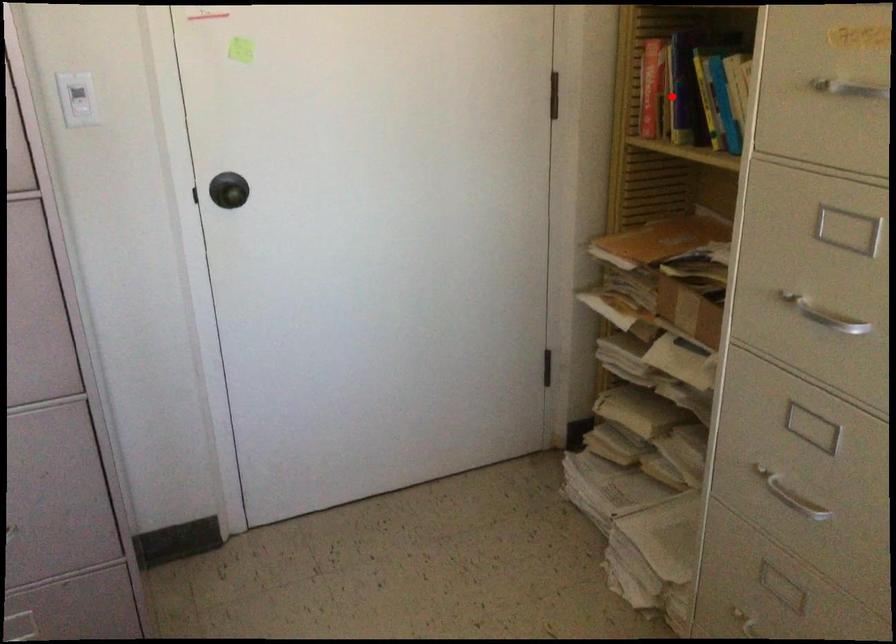
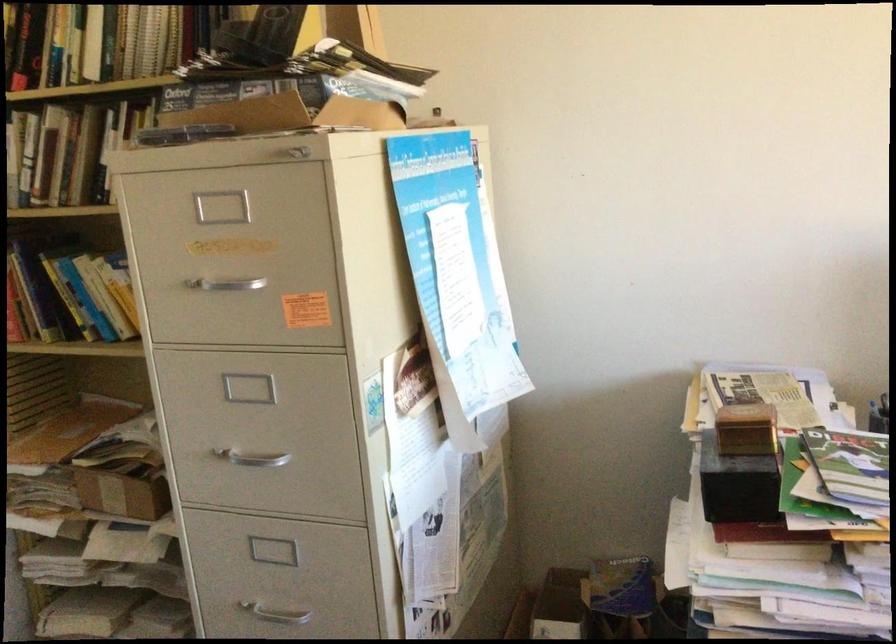
Find the pixel in the second image that matches the highlighted location in the first image.

(27, 301)